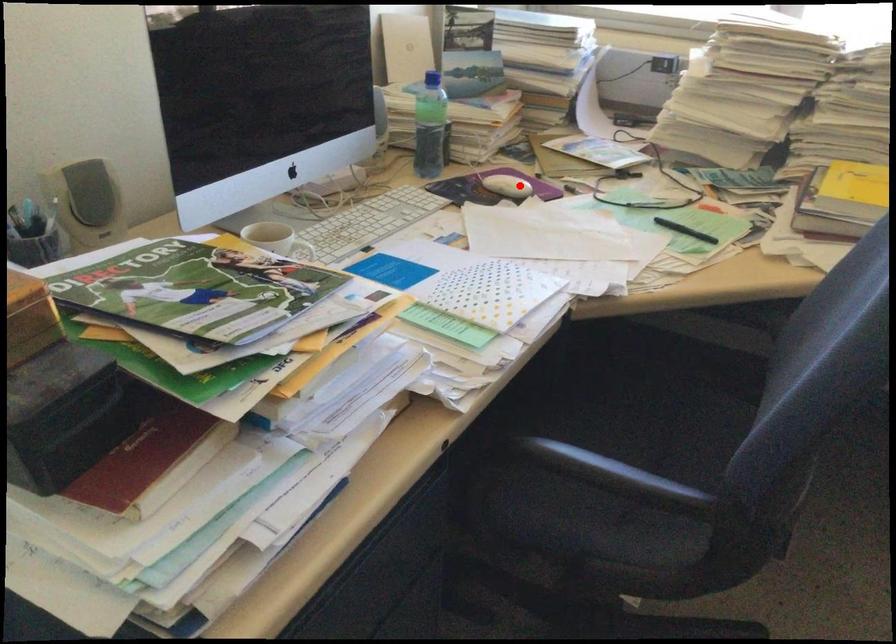
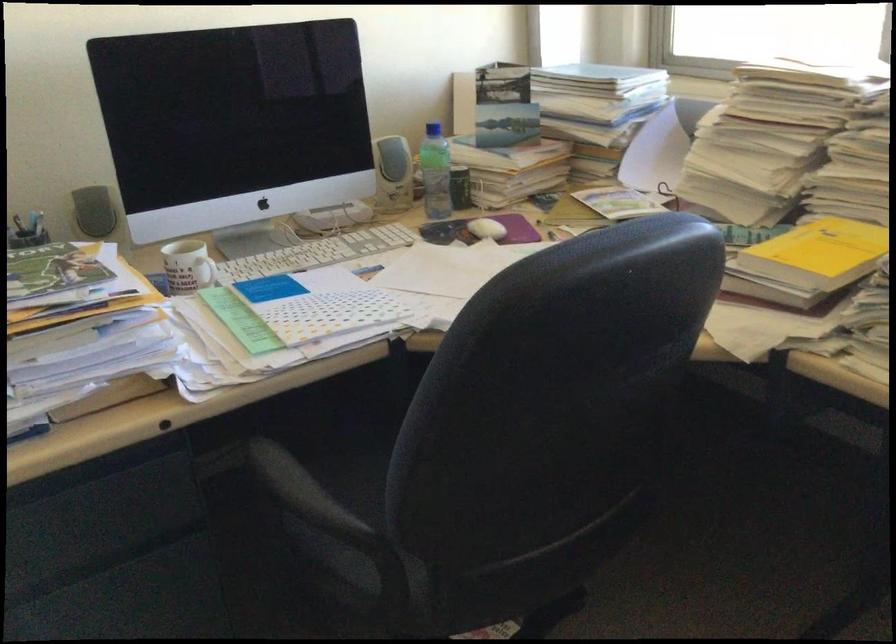
Where in the second image is the point corresponding to the highlighted location from the first image?

(487, 229)